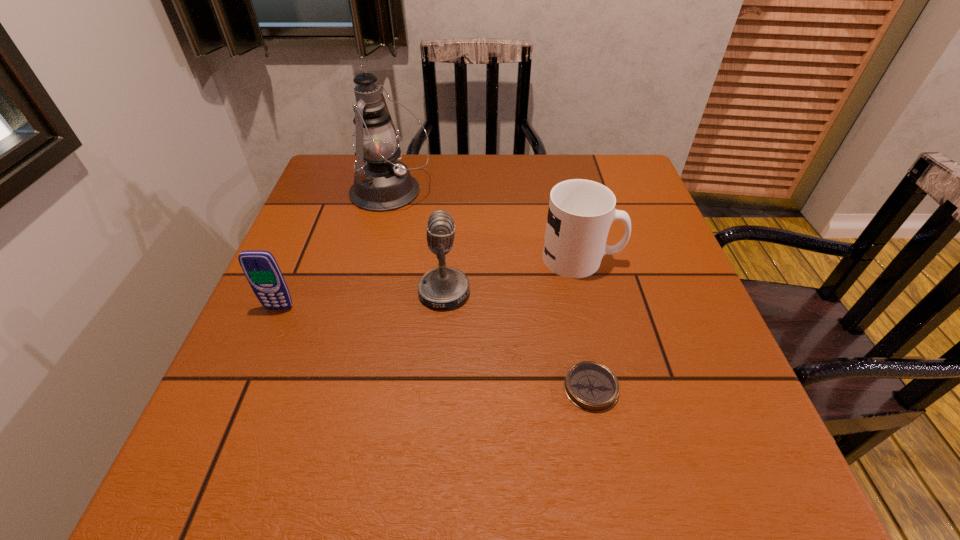
Identify the location of vacant space situated 0.090m on the handle side of the mug. The height and width of the screenshot is (540, 960). pyautogui.click(x=660, y=258).

Where is `vacant space located on the front-facing side of the cellular telephone`? vacant space located on the front-facing side of the cellular telephone is located at coordinates (225, 437).

Find the location of `blank space located on the left of the shortest object`. blank space located on the left of the shortest object is located at coordinates (422, 388).

You are a GUI agent. You are given a task and a screenshot of the screen. Output one action in this format:
    pyautogui.click(x=<x>, y=<y>)
    Task: Click on the object that is positioned at the far edge
    
    Given the screenshot: What is the action you would take?
    pyautogui.click(x=382, y=184)

Find the location of a particular element. The image size is (960, 540). oil lamp present at the left edge is located at coordinates (382, 184).

Locate an element on the screen. This screenshot has width=960, height=540. cellular telephone that is at the left edge is located at coordinates (261, 269).

Where is `object that is at the right edge`? The width and height of the screenshot is (960, 540). object that is at the right edge is located at coordinates (580, 214).

This screenshot has width=960, height=540. Identify the location of object situated at the far left corner. (382, 184).

In the image, there is a desktop. Where is `vacant space at the far edge`? The image size is (960, 540). vacant space at the far edge is located at coordinates (476, 167).

The width and height of the screenshot is (960, 540). In order to click on vacant area at the near edge in this screenshot , I will do `click(597, 485)`.